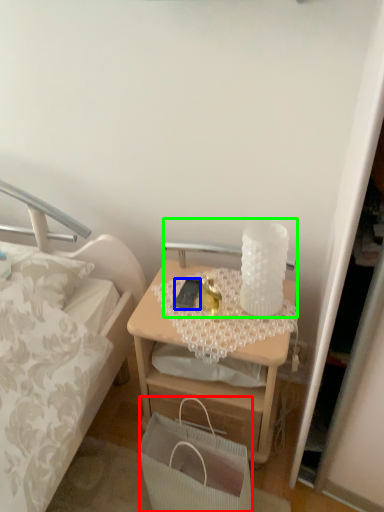
Question: Considering the real-world distances, which object is farthest from handbag (highlighted by a red box)? mobile phone (highlighted by a blue box) or table lamp (highlighted by a green box)?

Choices:
 (A) mobile phone
 (B) table lamp

Answer: (B)